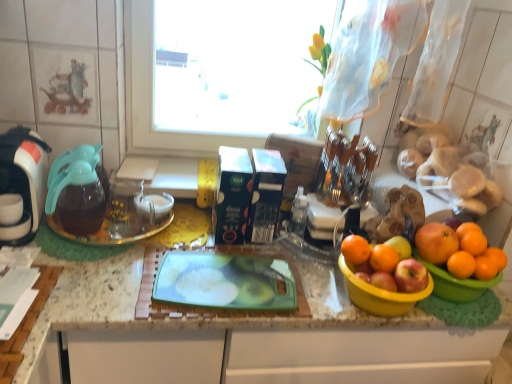
The height and width of the screenshot is (384, 512). Identify the location of vacant space to the right of transparent glass plate at left. (194, 233).